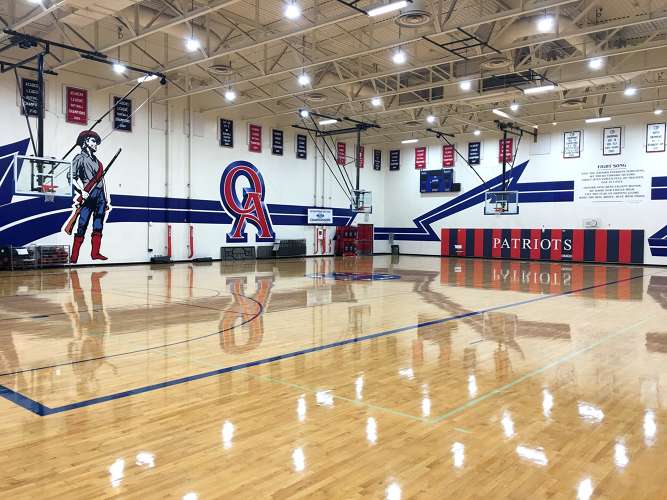
Image resolution: width=667 pixels, height=500 pixels. In order to click on white wall in this screenshot , I will do `click(213, 158)`.